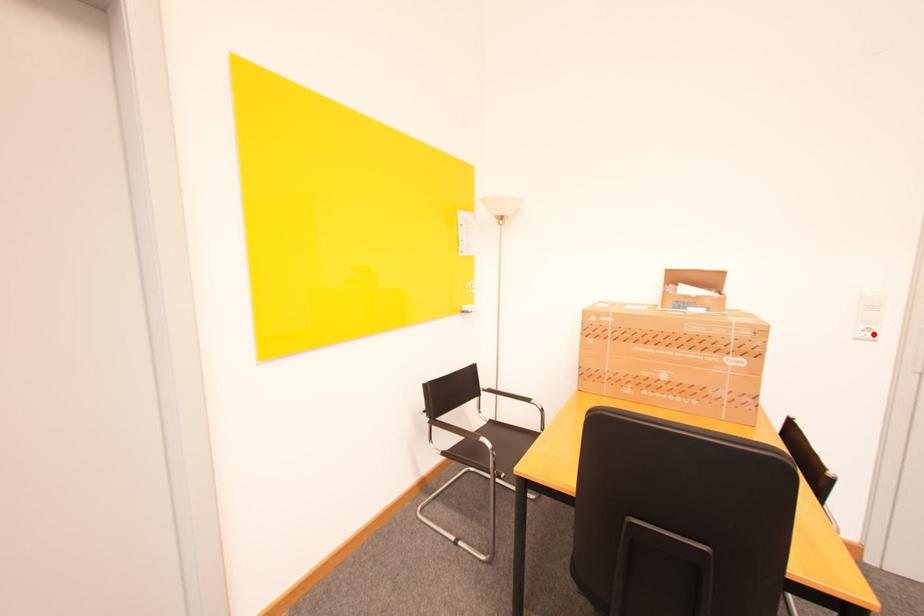
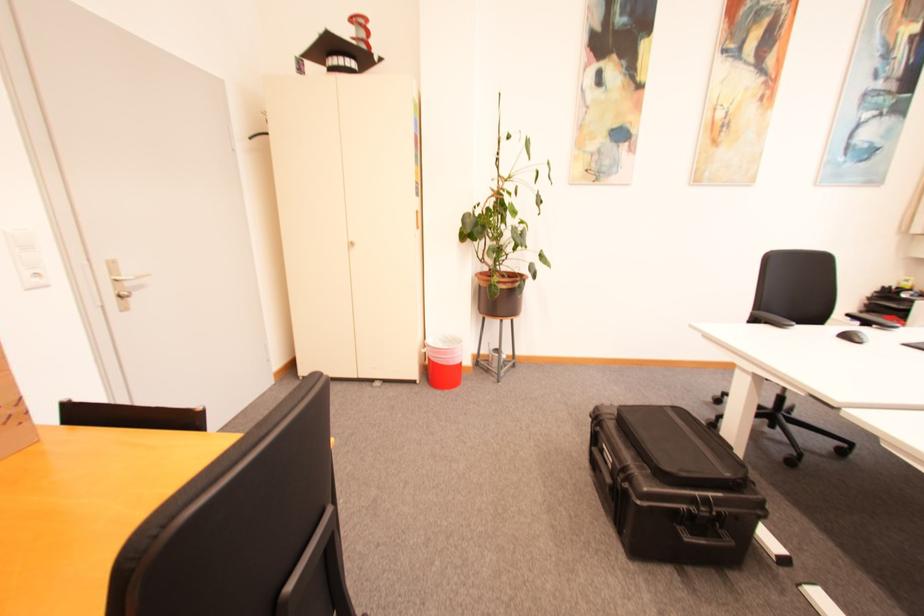
Find the pixel in the second image that matches the highlighted location in the first image.

(43, 281)